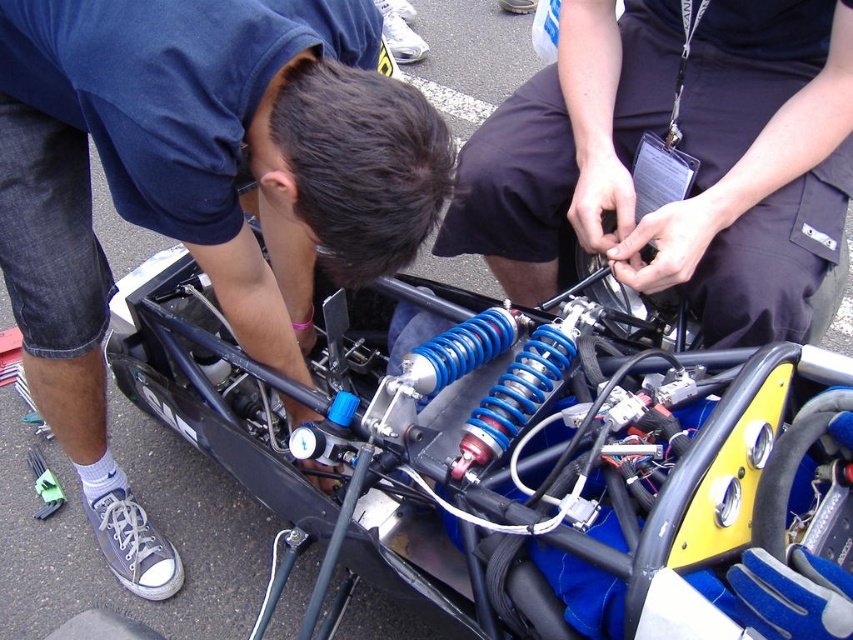
You are a mechanic working on a go kart. You need to install a new suspension system. The blue metallic suspension at center and the blue metallic coil at center must be spaced exactly 12 inches apart. Can you confirm if the current spacing between them is sufficient?

The current spacing between the blue metallic suspension at center and the blue metallic coil at center is 13.26 inches, which is more than the required 12 inches. Therefore, the current spacing is sufficient.

You are standing at the camera position and want to take a photo of the point at coordinates point (80, 209). Can you reach it without moving from your current position?

The point (80, 209) is 5.28 feet away from the camera, so yes, you can reach it without moving from your current position since it is within a reachable distance.

What is the color of the object located at coordinates point (196, 192)?

The object at point (196, 192) is blue metallic coil.